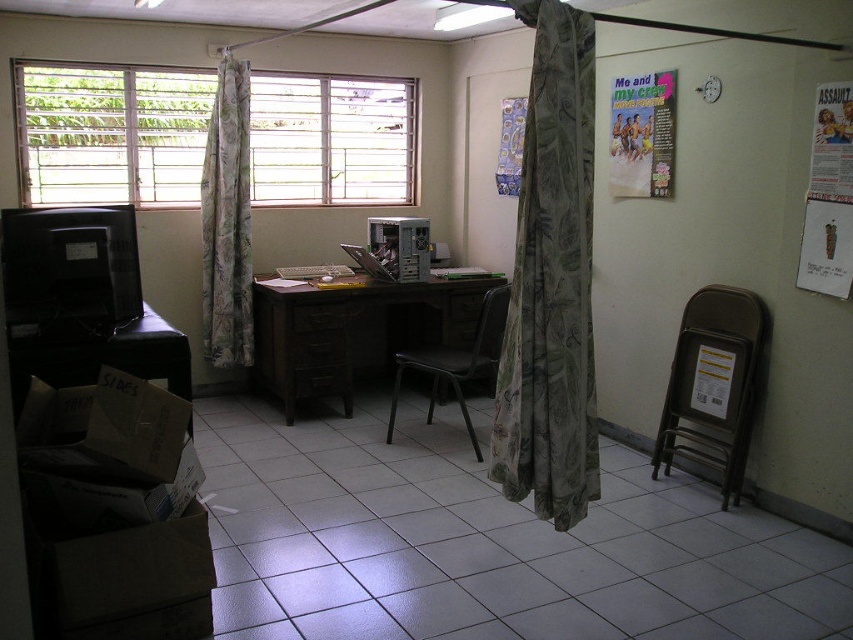
You are standing in the room and want to close the floral fabric curtain at left. Based on its position, which wall is the curtain likely attached to?

The floral fabric curtain at left is located at point (227, 220), which suggests it is attached to the left wall.

You are organizing a study space and want to ensure the brown wood drawer at center is visible. Since the floral fabric curtain at left might block the view, where exactly is the curtain positioned relative to the drawer?

The floral fabric curtain at left is located above the brown wood drawer at center, so it is positioned over the drawer, potentially blocking its view from certain angles.

You are organizing a small event in the room and need to know which object occupies more horizontal space. Which one is wider between the floral fabric curtain at left and the paperboard poster at upper right?

The floral fabric curtain at left is wider than the paperboard poster at upper right.